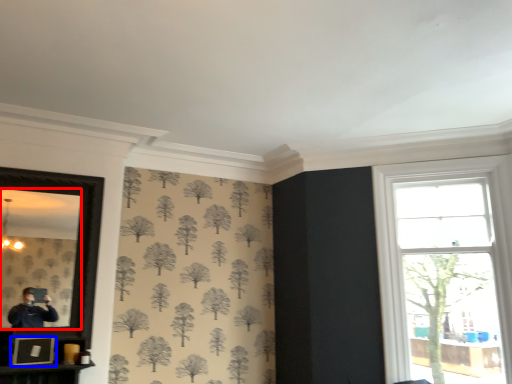
Question: Which of the following is the closest to the observer, mirror (highlighted by a red box) or picture frame (highlighted by a blue box)?

Choices:
 (A) mirror
 (B) picture frame

Answer: (A)